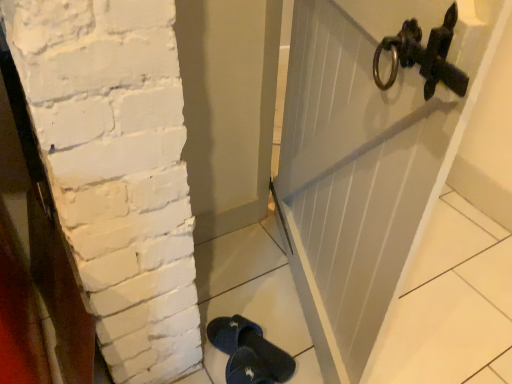
Question: Is white painted wood door at upper right spatially inside dark blue fabric slipper at lower center, or outside of it?

Choices:
 (A) inside
 (B) outside

Answer: (B)

Question: Considering their positions, is white painted wood door at upper right located in front of or behind dark blue fabric slipper at lower center?

Choices:
 (A) behind
 (B) front

Answer: (A)

Question: From the image's perspective, is white painted wood door at upper right positioned above or below dark blue fabric slipper at lower center?

Choices:
 (A) below
 (B) above

Answer: (B)

Question: Is dark blue fabric slipper at lower center situated inside white painted wood door at upper right or outside?

Choices:
 (A) outside
 (B) inside

Answer: (A)

Question: Is dark blue fabric slipper at lower center in front of or behind white painted wood door at upper right in the image?

Choices:
 (A) behind
 (B) front

Answer: (B)

Question: From their relative heights in the image, would you say dark blue fabric slipper at lower center is taller or shorter than white painted wood door at upper right?

Choices:
 (A) tall
 (B) short

Answer: (B)

Question: Is dark blue fabric slipper at lower center to the left or to the right of white painted wood door at upper right in the image?

Choices:
 (A) right
 (B) left

Answer: (B)